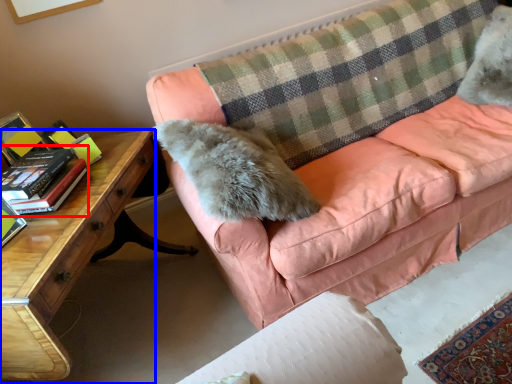
Question: Among these objects, which one is farthest to the camera, paperback book (highlighted by a red box) or desk (highlighted by a blue box)?

Choices:
 (A) paperback book
 (B) desk

Answer: (A)